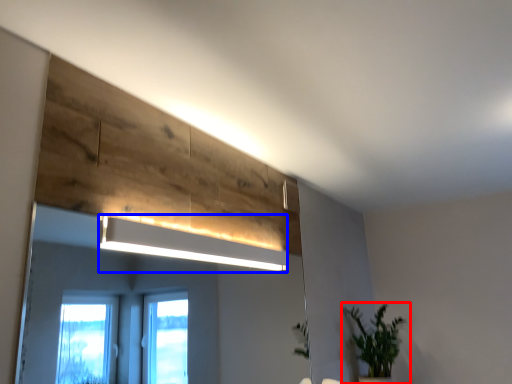
Question: Which point is closer to the camera, houseplant (highlighted by a red box) or lamp (highlighted by a blue box)?

Choices:
 (A) houseplant
 (B) lamp

Answer: (B)